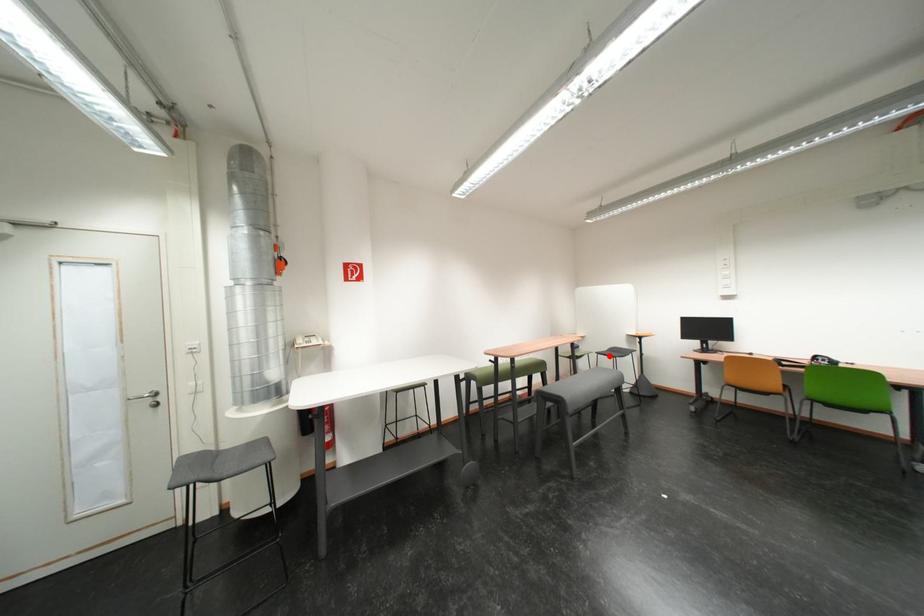
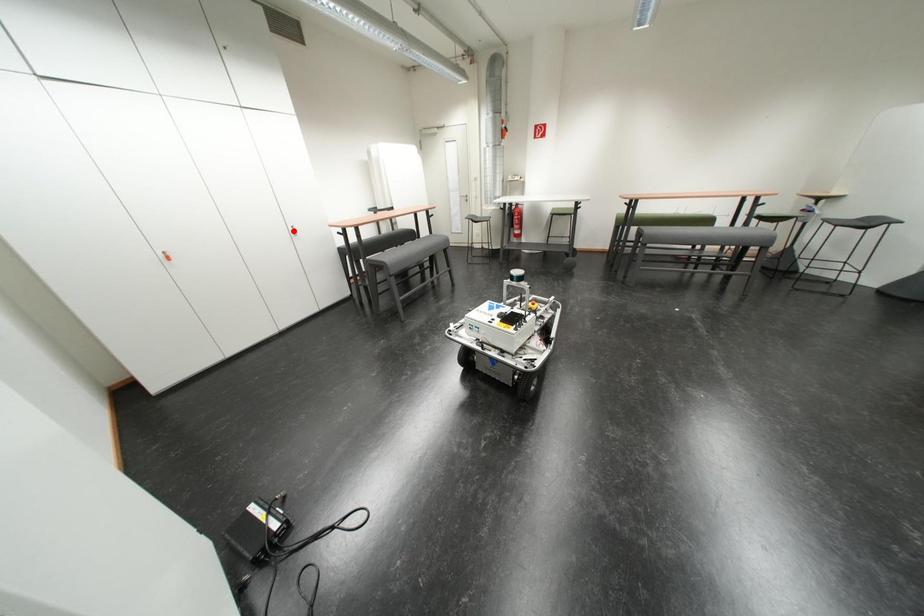
I am providing you with two images of the same scene from different viewpoints. A red point is marked on the first image and another point is marked on the second image. Is the red point in image1 aligned with the point shown in image2?

No